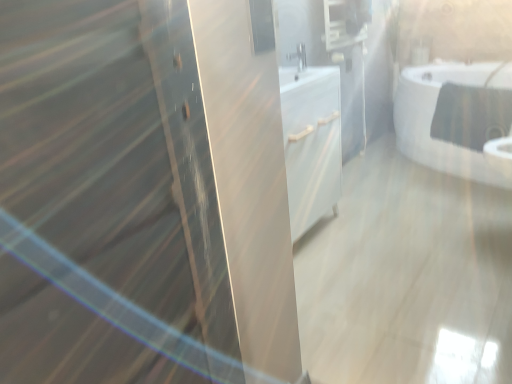
Locate an element on the screen. The image size is (512, 384). white glossy bathtub at upper right is located at coordinates (456, 118).

From the image's perspective, is satin nickel faucet at center below matte black medicine cabinet at upper center?

Indeed, from the image's perspective, satin nickel faucet at center is shown beneath matte black medicine cabinet at upper center.

Is matte black medicine cabinet at upper center at the back of satin nickel faucet at center?

Yes, satin nickel faucet at center's orientation is away from matte black medicine cabinet at upper center.

Does satin nickel faucet at center have a greater height compared to matte black medicine cabinet at upper center?

No, satin nickel faucet at center is not taller than matte black medicine cabinet at upper center.

Which object is closer to the camera, satin nickel faucet at center or matte black medicine cabinet at upper center?

satin nickel faucet at center is in front.

Is white glossy bathtub at upper right oriented towards satin nickel faucet at center?

No.

Is white glossy bathtub at upper right shorter than satin nickel faucet at center?

Incorrect, the height of white glossy bathtub at upper right does not fall short of that of satin nickel faucet at center.

From the picture: From a real-world perspective, is white glossy bathtub at upper right located beneath satin nickel faucet at center?

Indeed, from a real-world perspective, white glossy bathtub at upper right is positioned beneath satin nickel faucet at center.

Is point (502, 92) closer to viewer compared to point (290, 58)?

No, (502, 92) is further to viewer.

Is matte black medicine cabinet at upper center wider than satin nickel faucet at center?

Correct, the width of matte black medicine cabinet at upper center exceeds that of satin nickel faucet at center.

Considering the relative sizes of matte black medicine cabinet at upper center and satin nickel faucet at center in the image provided, is matte black medicine cabinet at upper center smaller than satin nickel faucet at center?

No, matte black medicine cabinet at upper center is not smaller than satin nickel faucet at center.

Is matte black medicine cabinet at upper center aimed at satin nickel faucet at center?

No, matte black medicine cabinet at upper center is not facing towards satin nickel faucet at center.

Does matte black medicine cabinet at upper center turn towards white glossy bathtub at upper right?

No, matte black medicine cabinet at upper center is not facing towards white glossy bathtub at upper right.

Does point (327, 14) lie in front of point (460, 138)?

No.

Which object is positioned more to the left, matte black medicine cabinet at upper center or white glossy bathtub at upper right?

From the viewer's perspective, matte black medicine cabinet at upper center appears more on the left side.

Considering their positions, is matte black medicine cabinet at upper center located in front of or behind white glossy bathtub at upper right?

matte black medicine cabinet at upper center is positioned farther from the viewer than white glossy bathtub at upper right.

Is satin nickel faucet at center closer to camera compared to white glossy bathtub at upper right?

Yes, satin nickel faucet at center is in front of white glossy bathtub at upper right.

From a real-world perspective, is satin nickel faucet at center positioned above or below white glossy bathtub at upper right?

Clearly, from a real-world perspective, satin nickel faucet at center is above white glossy bathtub at upper right.

Are satin nickel faucet at center and white glossy bathtub at upper right far apart?

Yes, satin nickel faucet at center and white glossy bathtub at upper right are quite far apart.

Is satin nickel faucet at center not within white glossy bathtub at upper right?

Yes, satin nickel faucet at center is located beyond the bounds of white glossy bathtub at upper right.

Does white glossy bathtub at upper right contain matte black medicine cabinet at upper center?

Actually, matte black medicine cabinet at upper center is outside white glossy bathtub at upper right.

At what (x,y) coordinates should I click in order to perform the action: click on medicine cabinet on the left of the white glossy bathtub at upper right. Please return your answer as a coordinate pair (x, y). Looking at the image, I should click on (345, 22).

From a real-world perspective, is white glossy bathtub at upper right below matte black medicine cabinet at upper center?

Correct, in the physical world, white glossy bathtub at upper right is lower than matte black medicine cabinet at upper center.

Is white glossy bathtub at upper right to the right of matte black medicine cabinet at upper center from the viewer's perspective?

Correct, you'll find white glossy bathtub at upper right to the right of matte black medicine cabinet at upper center.

Locate an element on the screen. The height and width of the screenshot is (384, 512). faucet lying on the left of matte black medicine cabinet at upper center is located at coordinates (298, 56).

Locate an element on the screen. Image resolution: width=512 pixels, height=384 pixels. bathtub behind the satin nickel faucet at center is located at coordinates (456, 118).

Considering their positions, is satin nickel faucet at center positioned closer to matte black medicine cabinet at upper center than white glossy bathtub at upper right?

Based on the image, satin nickel faucet at center appears to be nearer to matte black medicine cabinet at upper center.

Looking at the image, which one is located closer to white glossy bathtub at upper right, satin nickel faucet at center or matte black medicine cabinet at upper center?

matte black medicine cabinet at upper center.

Based on their spatial positions, is white glossy bathtub at upper right or satin nickel faucet at center closer to matte black medicine cabinet at upper center?

satin nickel faucet at center is positioned closer to the anchor matte black medicine cabinet at upper center.

From the picture: From the image, which object appears to be nearer to satin nickel faucet at center, white glossy bathtub at upper right or matte black medicine cabinet at upper center?

The object closer to satin nickel faucet at center is matte black medicine cabinet at upper center.

Looking at the image, which one is located closer to satin nickel faucet at center, matte black medicine cabinet at upper center or white glossy bathtub at upper right?

Based on the image, matte black medicine cabinet at upper center appears to be nearer to satin nickel faucet at center.

From the image, which object appears to be farther from white glossy bathtub at upper right, matte black medicine cabinet at upper center or satin nickel faucet at center?

The object further to white glossy bathtub at upper right is satin nickel faucet at center.

Locate an element on the screen. The image size is (512, 384). medicine cabinet between satin nickel faucet at center and white glossy bathtub at upper right in the horizontal direction is located at coordinates click(345, 22).